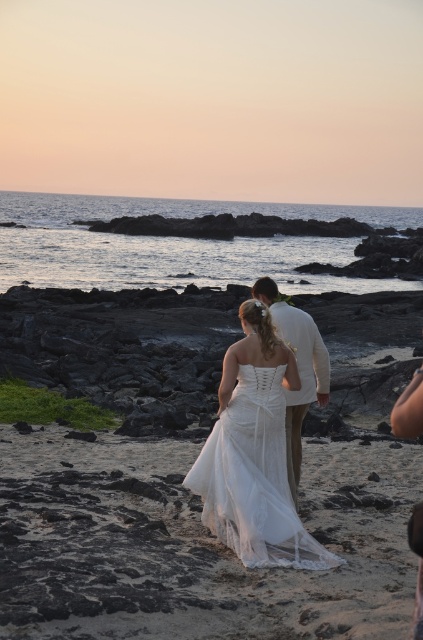
Question: Which of the following is the farthest from the observer?

Choices:
 (A) light beige cotton suit at center
 (B) white lace dress at center
 (C) white satin dress at center

Answer: (A)

Question: Which object is the closest to the white lace dress at center?

Choices:
 (A) white satin dress at center
 (B) light beige cotton suit at center

Answer: (A)

Question: Can you confirm if white lace dress at center is positioned above white satin dress at center?

Choices:
 (A) yes
 (B) no

Answer: (B)

Question: Can you confirm if white lace dress at center is positioned to the right of white satin dress at center?

Choices:
 (A) no
 (B) yes

Answer: (A)

Question: Which of the following is the farthest from the observer?

Choices:
 (A) light beige cotton suit at center
 (B) white lace dress at center
 (C) white satin dress at center

Answer: (A)

Question: Is white lace dress at center below white satin dress at center?

Choices:
 (A) yes
 (B) no

Answer: (A)